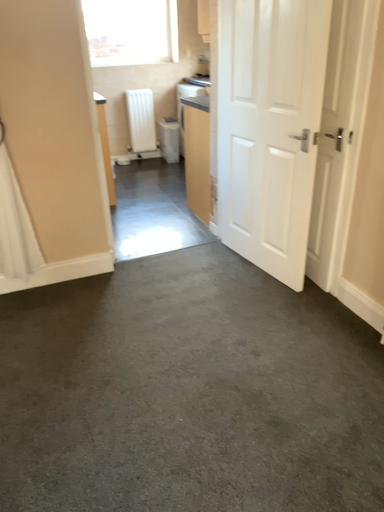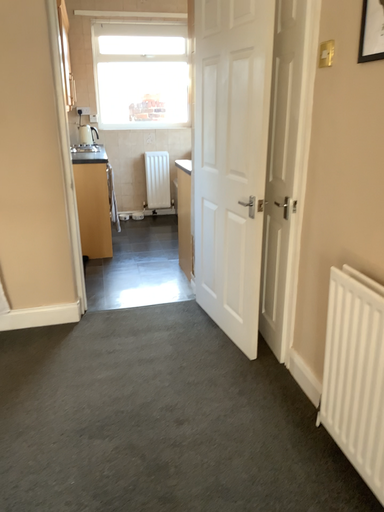
Question: Which way did the camera rotate in the video?

Choices:
 (A) rotated upward
 (B) rotated downward

Answer: (A)